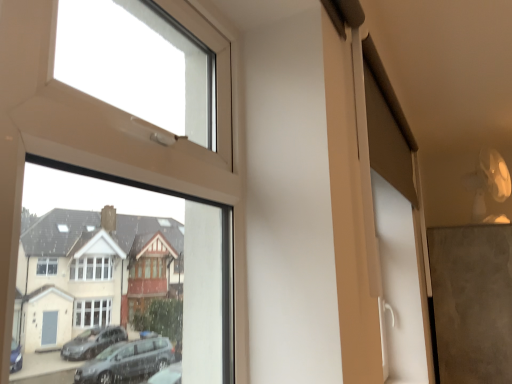
In order to click on matte plastic window at upper left in this screenshot , I will do `click(122, 278)`.

The height and width of the screenshot is (384, 512). Describe the element at coordinates (122, 278) in the screenshot. I see `matte plastic window at upper left` at that location.

Locate an element on the screen. The image size is (512, 384). matte plastic window at upper left is located at coordinates (122, 278).